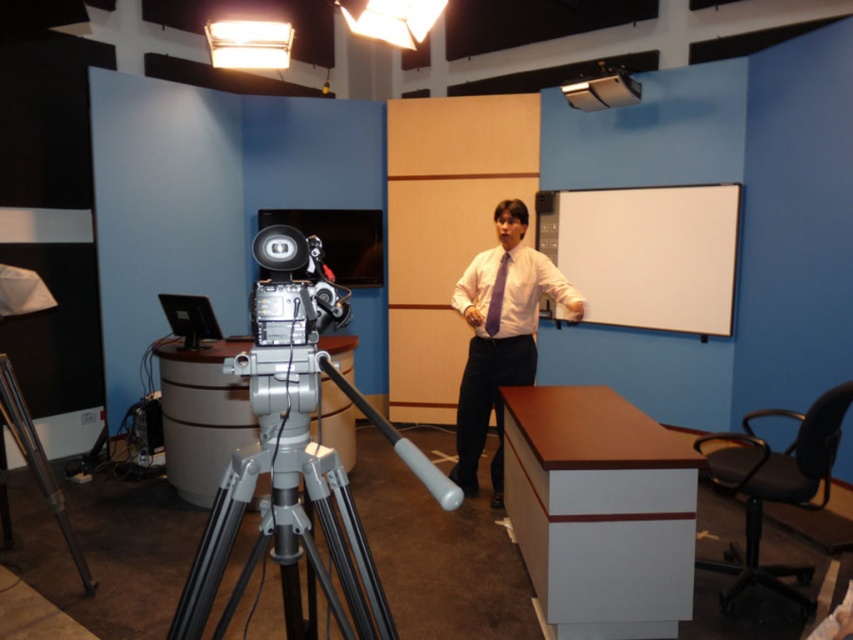
Is white matte projection screen at upper right closer to the viewer compared to metallic projector at upper right?

That is True.

You are a GUI agent. You are given a task and a screenshot of the screen. Output one action in this format:
    pyautogui.click(x=<x>, y=<y>)
    Task: Click on the white matte projection screen at upper right
    Image resolution: width=853 pixels, height=640 pixels.
    Given the screenshot: What is the action you would take?
    pyautogui.click(x=646, y=253)

Can you confirm if white matte projection screen at upper right is positioned to the right of white matte dress shirt at center?

Correct, you'll find white matte projection screen at upper right to the right of white matte dress shirt at center.

Between white matte projection screen at upper right and white matte dress shirt at center, which one has less height?

With less height is white matte dress shirt at center.

In order to click on white matte projection screen at upper right in this screenshot , I will do pyautogui.click(x=646, y=253).

Which is behind, point (677, 218) or point (494, 332)?

Positioned behind is point (677, 218).

Can you confirm if white matte projection screen at upper right is taller than purple matte shirt at center?

No, white matte projection screen at upper right is not taller than purple matte shirt at center.

The height and width of the screenshot is (640, 853). Find the location of `white matte projection screen at upper right`. white matte projection screen at upper right is located at coordinates (646, 253).

Find the location of a particular element. This screenshot has width=853, height=640. white matte projection screen at upper right is located at coordinates (646, 253).